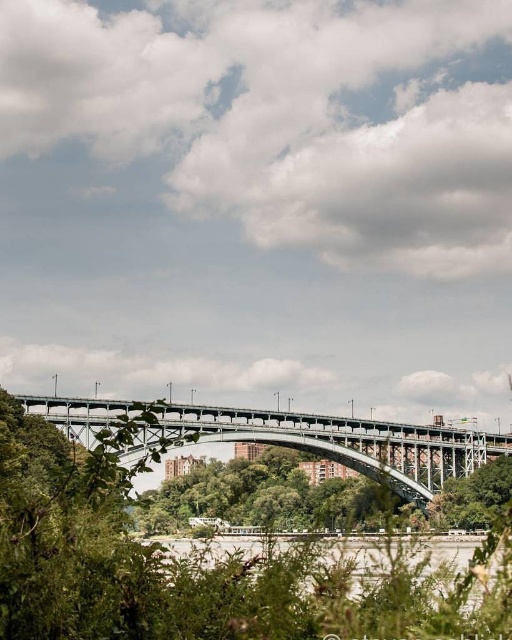
You are a photographer planning to capture the metallic gray bridge at center and the gray concrete river at center in a single shot. Based on their heights, which one should appear taller in the photo?

The metallic gray bridge at center is taller than the gray concrete river at center, so it should appear taller in the photo.

You are a bird flying above the steel arch bridge. You see the green leafy tree at center and the gray concrete river at center. Which object is located above the other?

The green leafy tree at center is positioned over gray concrete river at center.